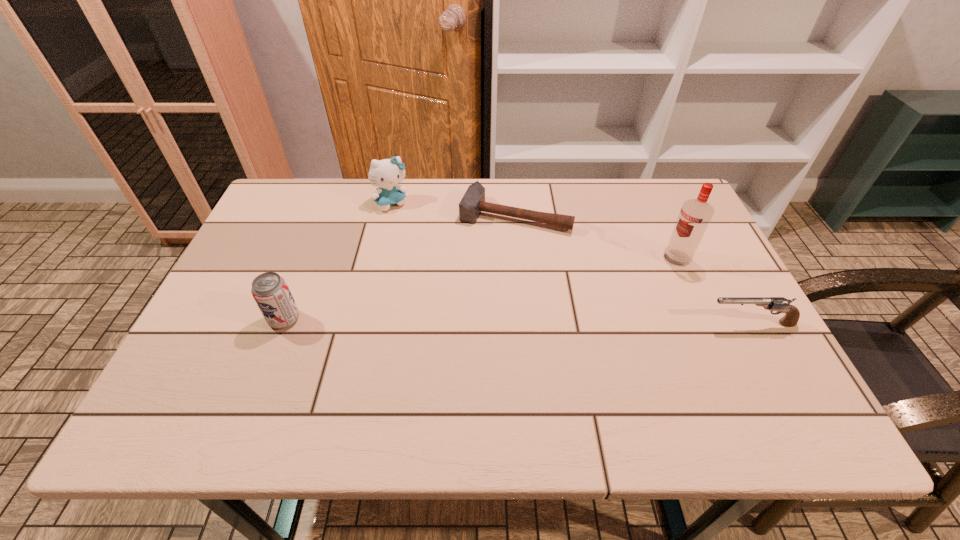
I want to click on vacant space on the desktop that is between the leftmost object and the second shortest object and is positioned on the striking surface of the third object from right to left, so click(x=472, y=321).

Find the location of `vacant space on the desktop that is between the beer can and the second shortest object and is positioned on the face of the second tallest object`. vacant space on the desktop that is between the beer can and the second shortest object and is positioned on the face of the second tallest object is located at coordinates (468, 321).

This screenshot has width=960, height=540. Find the location of `vacant space on the desktop that is between the leftmost object and the gun and is positioned on the front label of the tallest object`. vacant space on the desktop that is between the leftmost object and the gun and is positioned on the front label of the tallest object is located at coordinates pos(572,322).